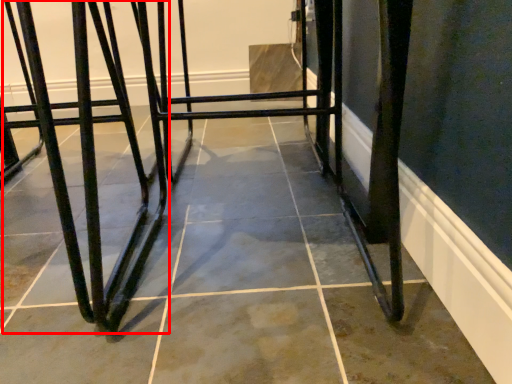
Question: From the image's perspective, where is bar stool (annotated by the red box) located relative to furniture?

Choices:
 (A) above
 (B) below

Answer: (B)